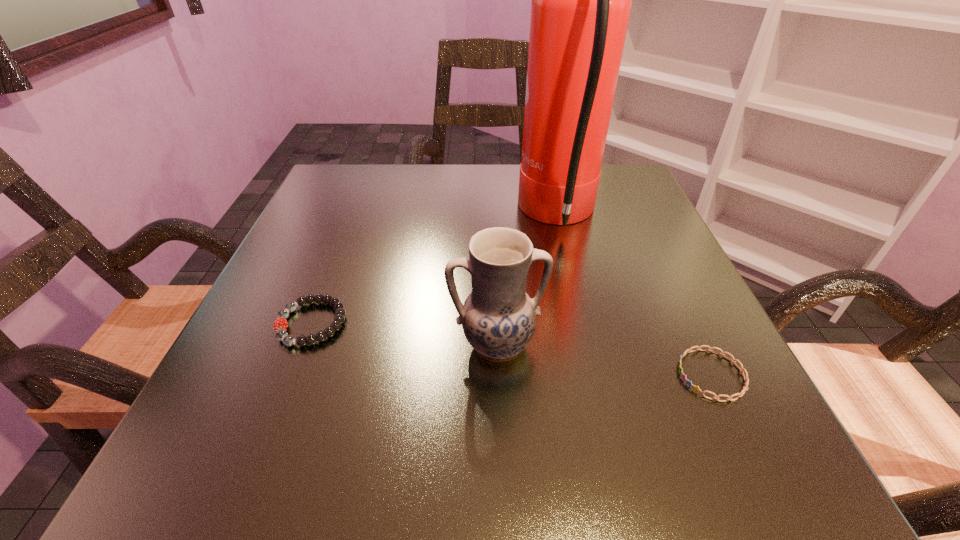
The image size is (960, 540). What are the coordinates of `vacant space at the near edge of the desktop` in the screenshot? It's located at (461, 428).

Where is `free space at the left edge of the desktop`? This screenshot has width=960, height=540. free space at the left edge of the desktop is located at coordinates (x=312, y=376).

Where is `vacant area at the right edge`? vacant area at the right edge is located at coordinates (603, 233).

You are a GUI agent. You are given a task and a screenshot of the screen. Output one action in this format:
    pyautogui.click(x=<x>, y=<y>)
    Task: Click on the free spot at the far left corner of the desktop
    The width and height of the screenshot is (960, 540).
    Given the screenshot: What is the action you would take?
    pyautogui.click(x=349, y=178)

Find the location of a particular element. This screenshot has width=960, height=540. free point at the near left corner is located at coordinates pyautogui.click(x=174, y=473).

Locate an element on the screen. This screenshot has width=960, height=540. vacant point at the far right corner is located at coordinates (606, 200).

You are a GUI agent. You are given a task and a screenshot of the screen. Output one action in this format:
    pyautogui.click(x=<x>, y=<y>)
    Task: Click on the vacant space at the near right corner of the desktop
    
    Given the screenshot: What is the action you would take?
    pyautogui.click(x=661, y=421)

I want to click on vacant space in between the tallest object and the taller bracelet, so click(x=435, y=269).

This screenshot has width=960, height=540. I want to click on vacant area between the second tallest object and the farthest object, so click(x=528, y=280).

Identify the location of free spot between the pottery and the right bracelet. (604, 360).